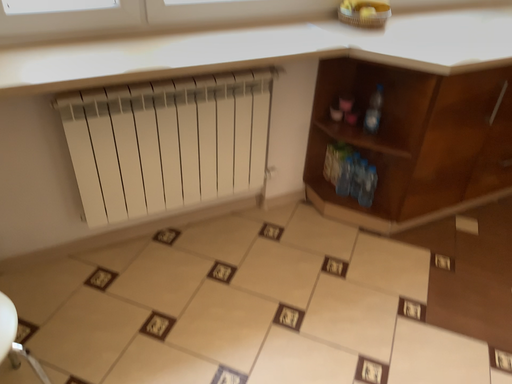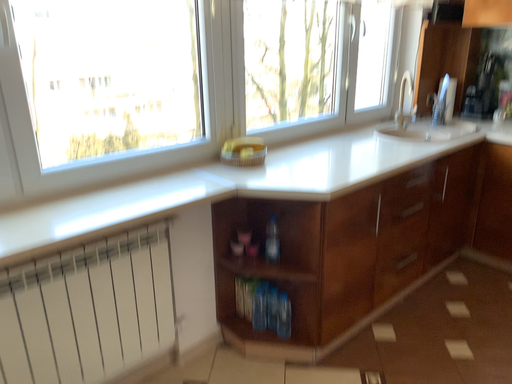
Question: Which way did the camera rotate in the video?

Choices:
 (A) rotated left
 (B) rotated right

Answer: (B)